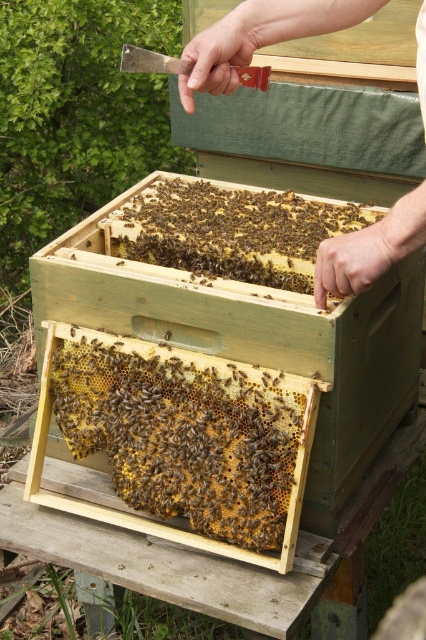
Does brown textured honeycomb at center have a lesser height compared to smooth wooden hive at center?

Indeed, brown textured honeycomb at center has a lesser height compared to smooth wooden hive at center.

Can you confirm if brown textured honeycomb at center is taller than smooth wooden hive at center?

In fact, brown textured honeycomb at center may be shorter than smooth wooden hive at center.

What do you see at coordinates (233, 230) in the screenshot? This screenshot has height=640, width=426. I see `brown textured honeycomb at center` at bounding box center [233, 230].

Find the location of a particular element. The width and height of the screenshot is (426, 640). brown textured honeycomb at center is located at coordinates (233, 230).

Can you confirm if brown wax comb at center is positioned below smooth wooden hive at center?

Indeed, brown wax comb at center is positioned under smooth wooden hive at center.

This screenshot has width=426, height=640. Identify the location of brown wax comb at center. (181, 438).

Is the position of wooden beehive at center less distant than that of smooth wooden hive at center?

No, it is behind smooth wooden hive at center.

Between wooden beehive at center and smooth wooden hive at center, which one is positioned lower?

Positioned lower is wooden beehive at center.

Does point (310, 324) lie in front of point (226, 74)?

Yes, it is in front of point (226, 74).

Locate an element on the screen. The width and height of the screenshot is (426, 640). wooden beehive at center is located at coordinates (253, 337).